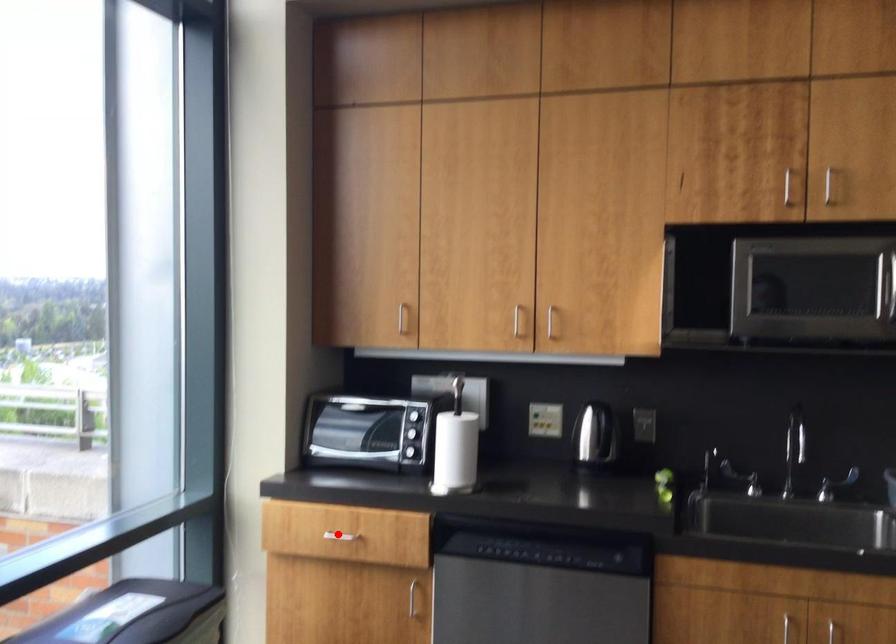
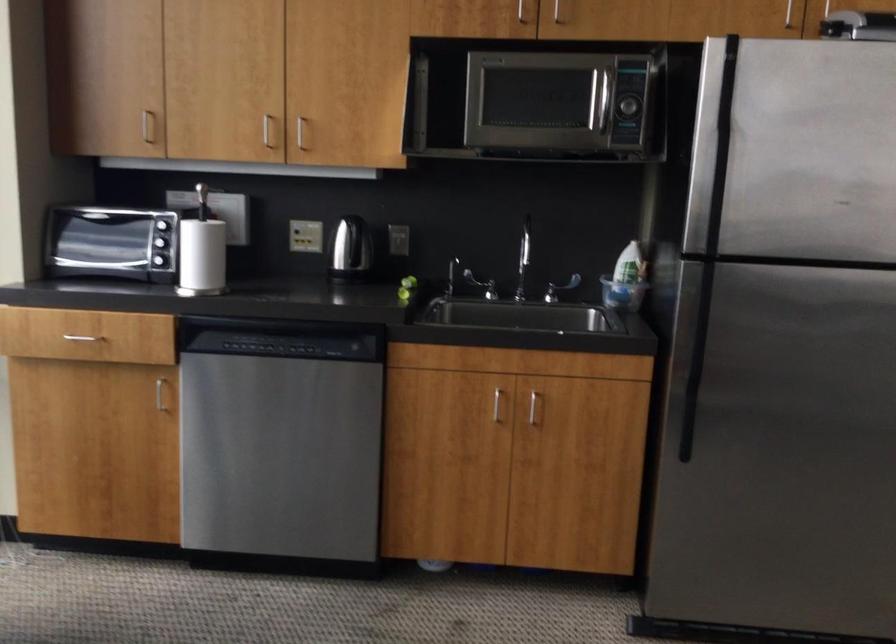
Locate, in the second image, the point that corresponds to the highlighted location in the first image.

(82, 337)